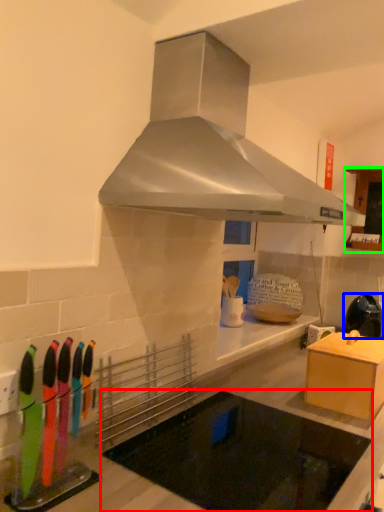
Question: Which object is positioned closest to appliance (highlighted by a red box)? Select from kitchen appliance (highlighted by a blue box) and cabinetry (highlighted by a green box).

Choices:
 (A) kitchen appliance
 (B) cabinetry

Answer: (A)